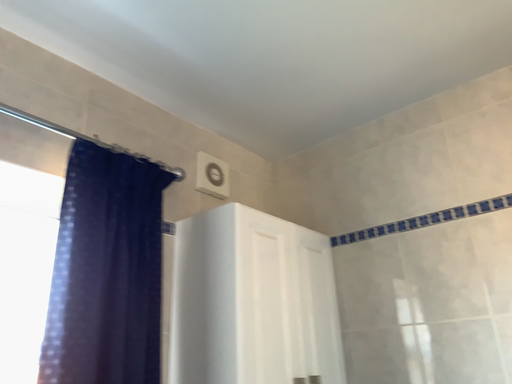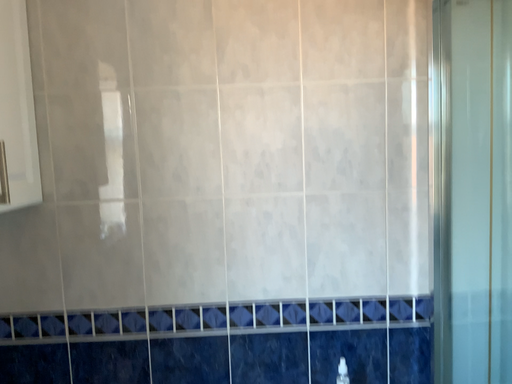
Question: Which way did the camera rotate in the video?

Choices:
 (A) rotated left
 (B) rotated right

Answer: (B)